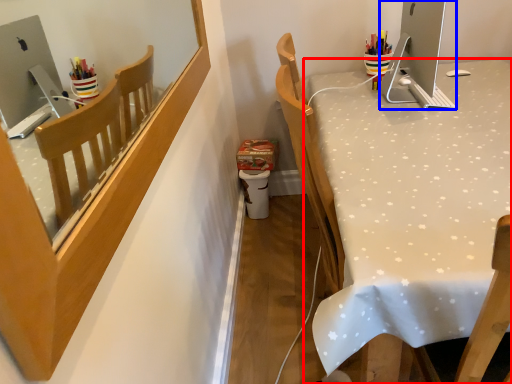
Question: Which object is further to the camera taking this photo, desk (highlighted by a red box) or desktop (highlighted by a blue box)?

Choices:
 (A) desk
 (B) desktop

Answer: (B)